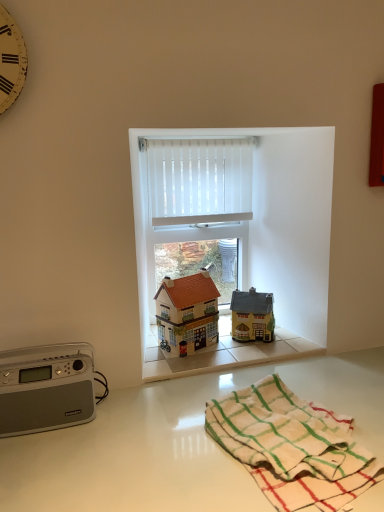
At what (x,y) coordinates should I click in order to perform the action: click on free space in front of matte yellow house at center, the 1th toy when ordered from right to left. Please return your answer as a coordinate pair (x, y). The width and height of the screenshot is (384, 512). Looking at the image, I should click on (249, 353).